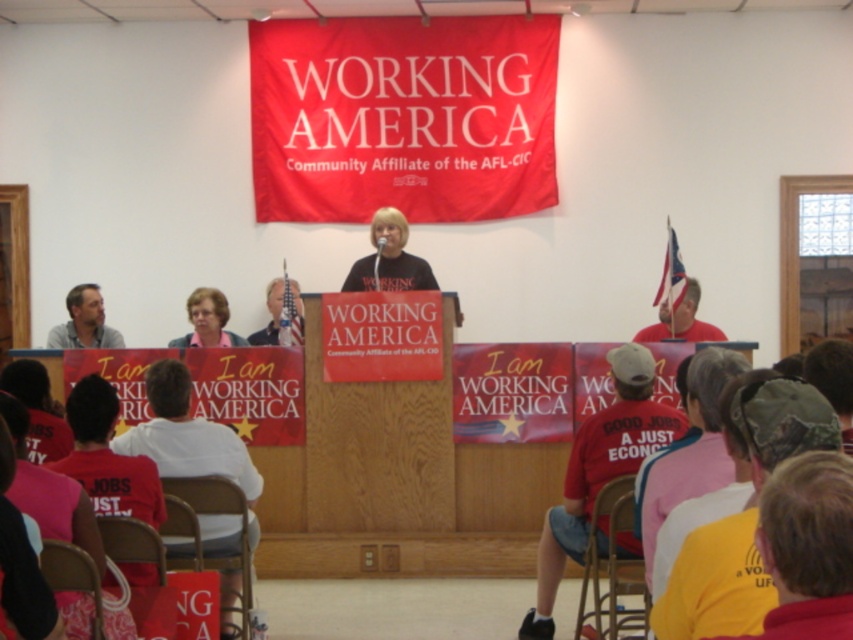
Question: Is pink fabric shirt at center smaller than red t-shirt at right?

Choices:
 (A) no
 (B) yes

Answer: (B)

Question: Can you confirm if matte gray shirt at left is thinner than red t-shirt at right?

Choices:
 (A) no
 (B) yes

Answer: (B)

Question: Is matte gray shirt at left wider than red t-shirt at right?

Choices:
 (A) no
 (B) yes

Answer: (A)

Question: Which point is farther to the camera?

Choices:
 (A) (212, 310)
 (B) (682, 336)
 (C) (57, 326)

Answer: (C)

Question: Among these points, which one is nearest to the camera?

Choices:
 (A) (196, 317)
 (B) (82, 342)

Answer: (A)

Question: Which object is the closest to the pink fabric shirt at center?

Choices:
 (A) red t-shirt at right
 (B) matte gray shirt at left

Answer: (B)